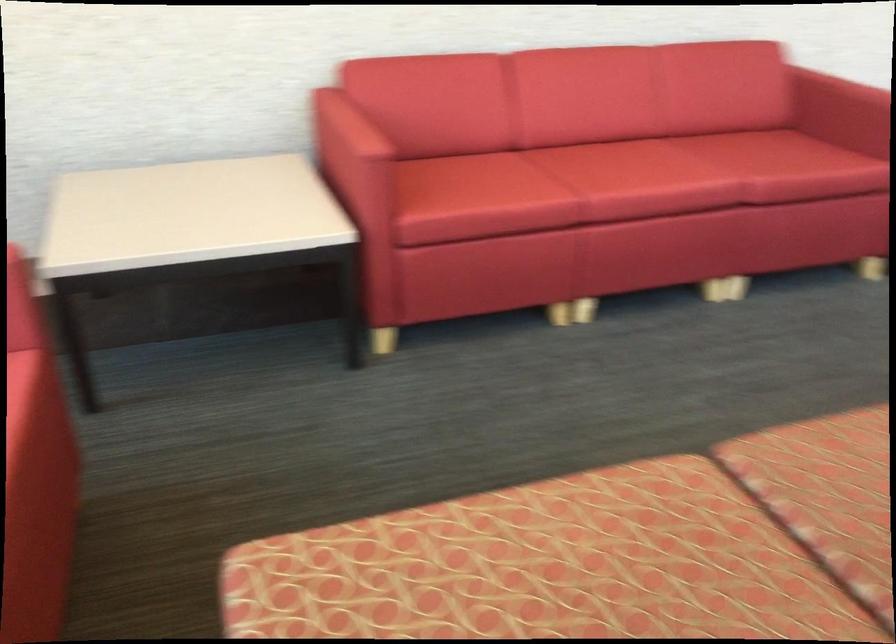
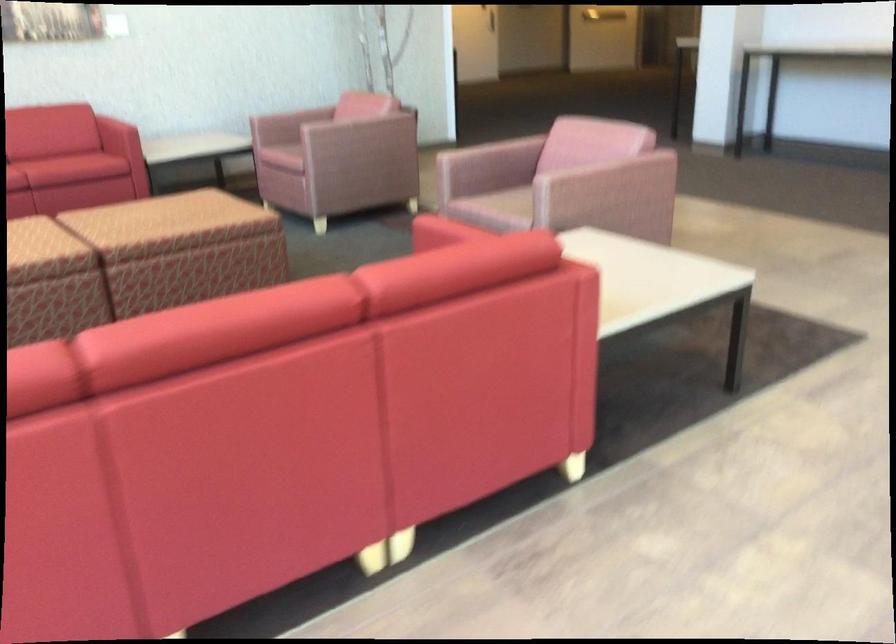
In the scene shown: What movement of the cameraman would produce the second image?

The cameraman moved toward right, backward.